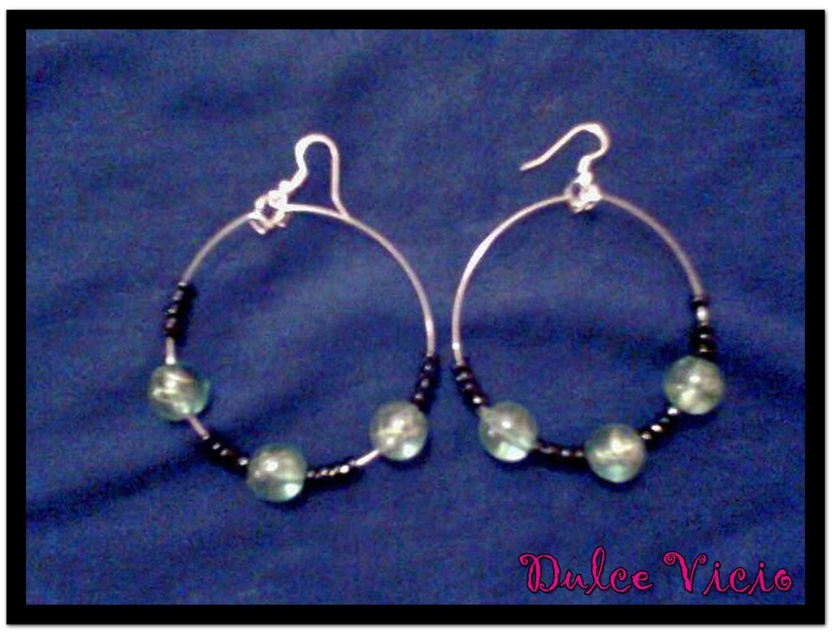
Question: Can you confirm if translucent glass bead at center is positioned to the left of pearl-like glass bead at center?

Choices:
 (A) yes
 (B) no

Answer: (A)

Question: Which object appears closest to the camera in this image?

Choices:
 (A) translucent glass bead at left
 (B) translucent glass bead at center

Answer: (A)

Question: Which of the following is the farthest from the observer?

Choices:
 (A) (418, 420)
 (B) (617, 456)
 (C) (526, 420)

Answer: (A)

Question: Is pearl-like glass hoop at center closer to camera compared to pearl-like glass bead at center?

Choices:
 (A) yes
 (B) no

Answer: (A)

Question: Which of the following is the closest to the observer?

Choices:
 (A) pearl-like glass bead at center
 (B) translucent glass bead at left
 (C) pearl-like glass hoop at center
 (D) translucent glass bead at center

Answer: (C)

Question: Does translucent glass bead at left appear under pearl-like glass bead at center?

Choices:
 (A) no
 (B) yes

Answer: (A)